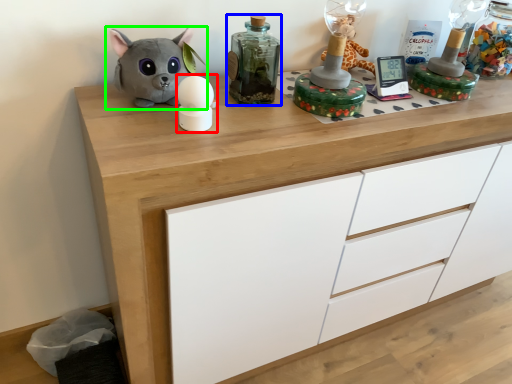
Question: Estimate the real-world distances between objects in this image. Which object is closer to toy (highlighted by a red box), bottle (highlighted by a blue box) or toy (highlighted by a green box)?

Choices:
 (A) bottle
 (B) toy

Answer: (B)